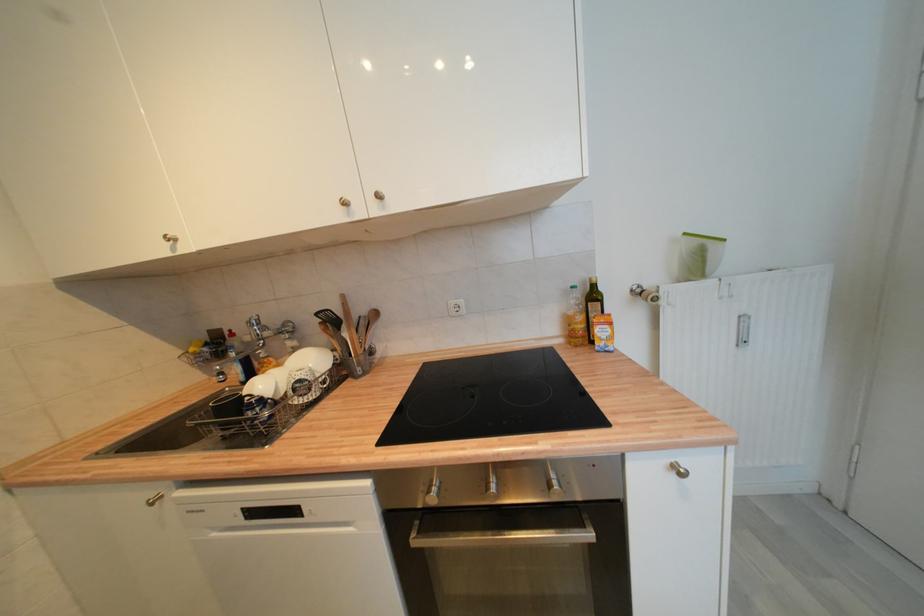
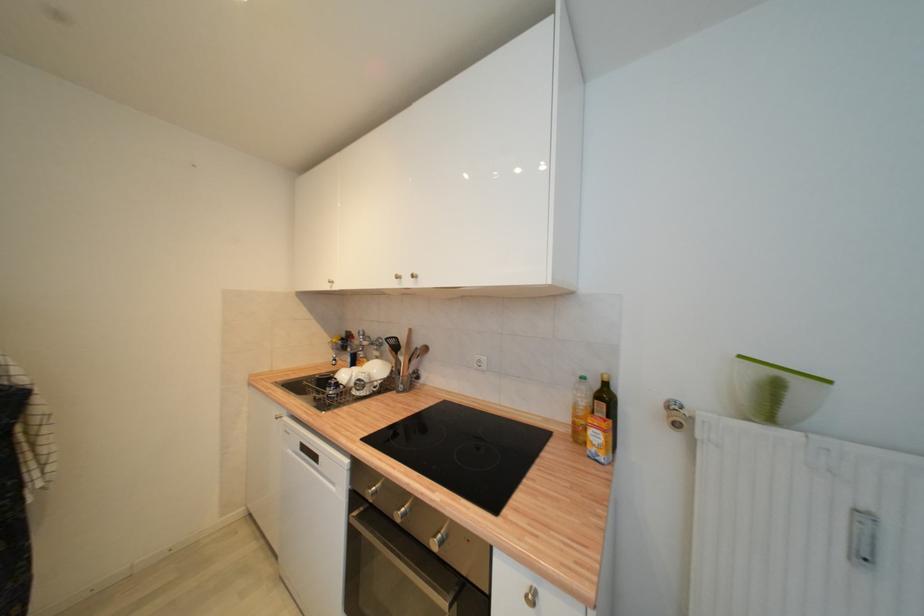
The point at (304, 383) is marked in the first image. Where is the corresponding point in the second image?

(363, 382)